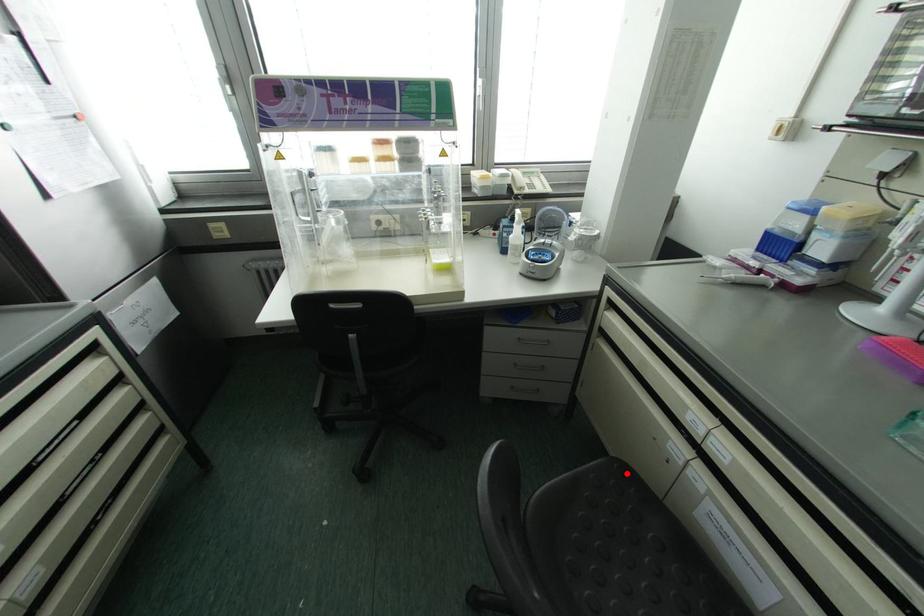
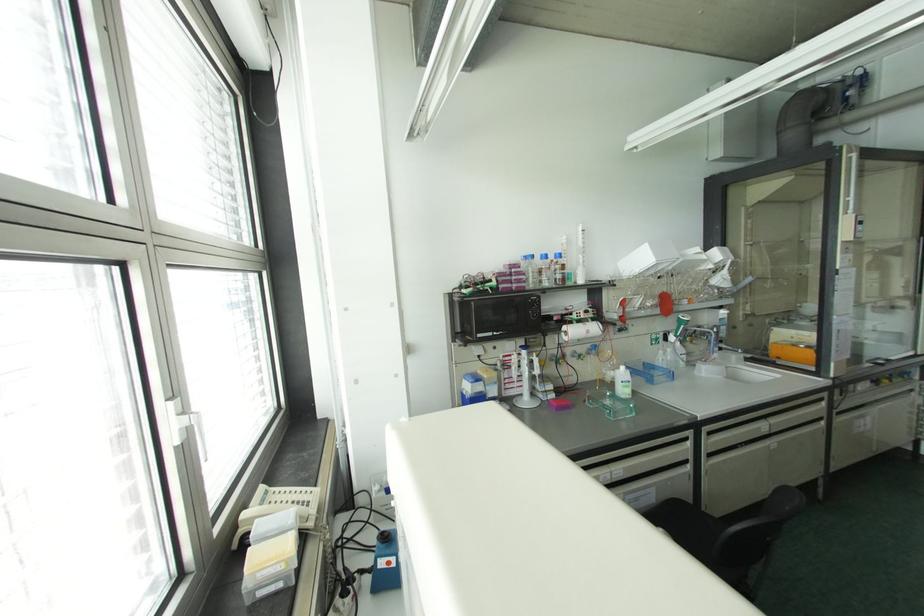
Question: I am providing you with two images of the same scene from different viewpoints. A red point is marked on the first image. Can you still see the location of the red point in image 2?

Choices:
 (A) Yes
 (B) No

Answer: (B)